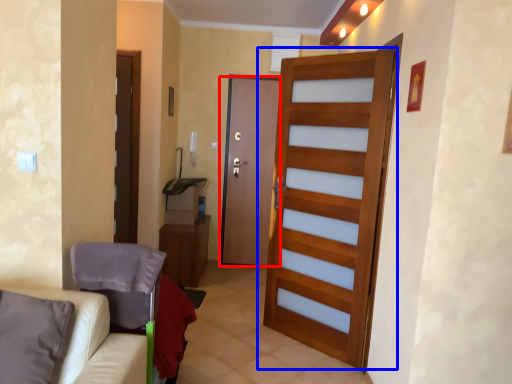
Question: Which point is further to the camera, door (highlighted by a red box) or door (highlighted by a blue box)?

Choices:
 (A) door
 (B) door

Answer: (A)